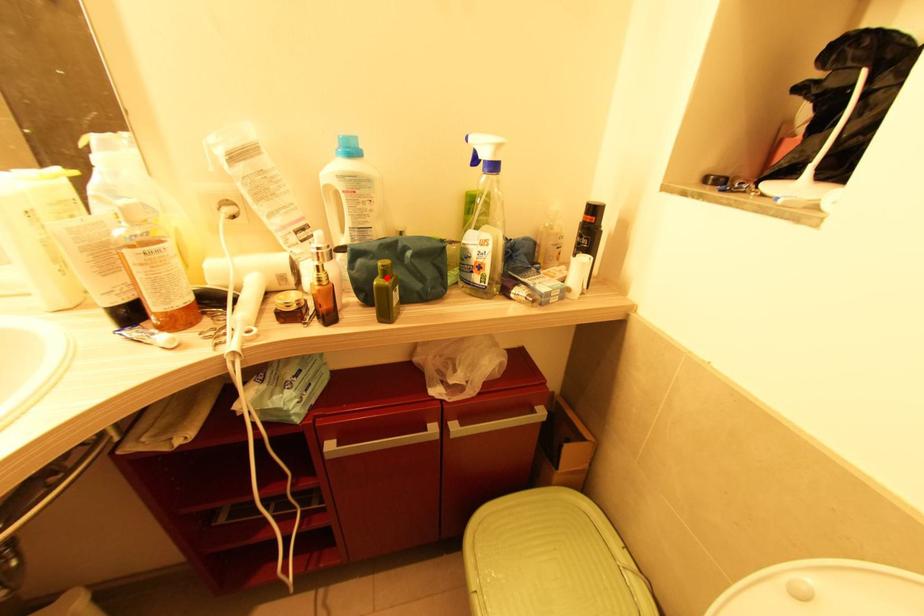
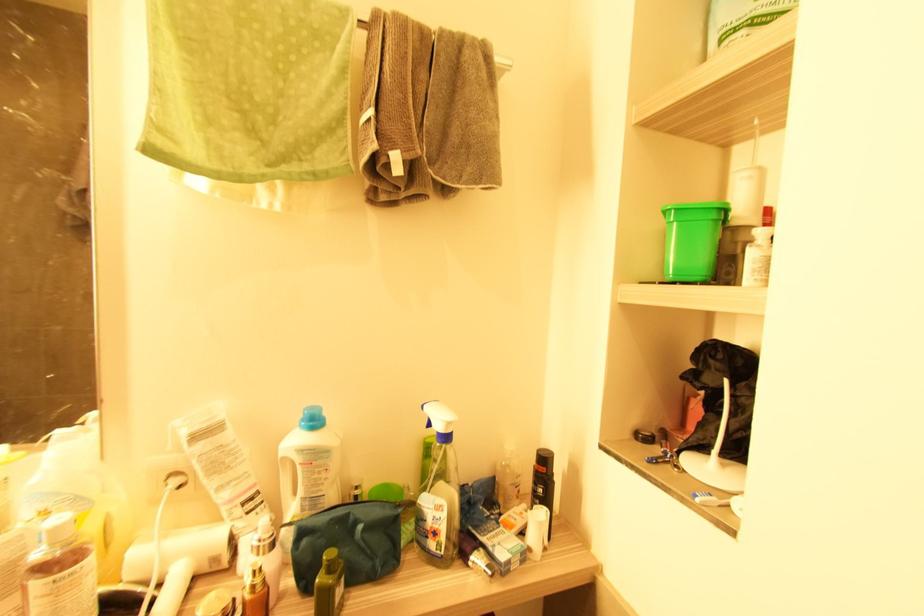
Locate, in the second image, the point that corresponds to the highlighted location in the first image.

(331, 572)